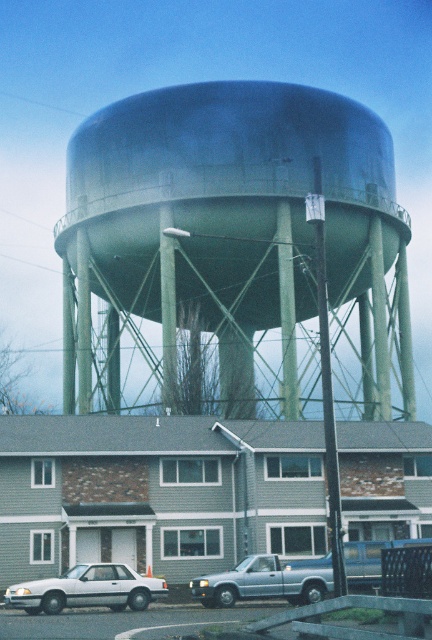
Consider the image. You are a drone operator trying to capture a photo of the silver metallic truck at lower center without the green matte water tower at center blocking the view. Is it possible to angle the camera so that the truck is visible without the water tower in the frame?

The green matte water tower at center is above the silver metallic truck at lower center, so angling the camera downward or positioning it lower might allow capturing the truck without the water tower blocking the view.